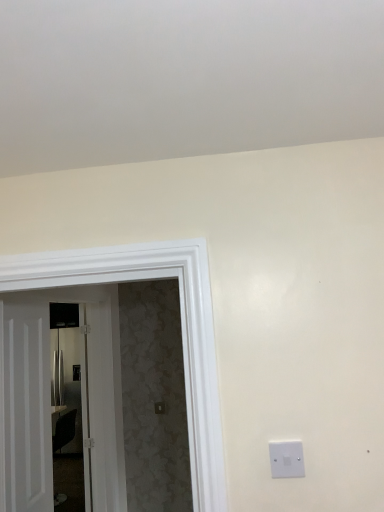
Question: Is white plastic light switch at lower right shorter than metallic silver refrigerator at left?

Choices:
 (A) no
 (B) yes

Answer: (B)

Question: Is white plastic light switch at lower right at the left side of metallic silver refrigerator at left?

Choices:
 (A) yes
 (B) no

Answer: (B)

Question: From the image's perspective, is white plastic light switch at lower right located above metallic silver refrigerator at left?

Choices:
 (A) no
 (B) yes

Answer: (B)

Question: Are white plastic light switch at lower right and metallic silver refrigerator at left far apart?

Choices:
 (A) yes
 (B) no

Answer: (A)

Question: Does white plastic light switch at lower right have a greater height compared to metallic silver refrigerator at left?

Choices:
 (A) no
 (B) yes

Answer: (A)

Question: Would you say metallic silver refrigerator at left is part of white plastic light switch at lower right's contents?

Choices:
 (A) yes
 (B) no

Answer: (B)

Question: Considering the relative sizes of white glossy door at left, acting as the second door starting from the left, and white plastic light switch at lower right in the image provided, is white glossy door at left, acting as the second door starting from the left, wider than white plastic light switch at lower right?

Choices:
 (A) no
 (B) yes

Answer: (B)

Question: Considering the relative sizes of white glossy door at left, acting as the second door starting from the left, and white plastic light switch at lower right in the image provided, is white glossy door at left, acting as the second door starting from the left, bigger than white plastic light switch at lower right?

Choices:
 (A) yes
 (B) no

Answer: (A)

Question: Is white glossy door at left, which appears as the first door when viewed from the right, further to the viewer compared to white plastic light switch at lower right?

Choices:
 (A) no
 (B) yes

Answer: (B)

Question: From the image's perspective, does white glossy door at left, which appears as the first door when viewed from the right, appear lower than white plastic light switch at lower right?

Choices:
 (A) no
 (B) yes

Answer: (B)

Question: Is white glossy door at left, acting as the second door starting from the left, far away from white plastic light switch at lower right?

Choices:
 (A) yes
 (B) no

Answer: (A)

Question: Is white glossy door at left, acting as the second door starting from the left, not within white plastic light switch at lower right?

Choices:
 (A) no
 (B) yes

Answer: (B)

Question: Are white glossy door at left, which appears as the first door when viewed from the right, and white wooden door at left, the second door viewed from the right, beside each other?

Choices:
 (A) no
 (B) yes

Answer: (A)